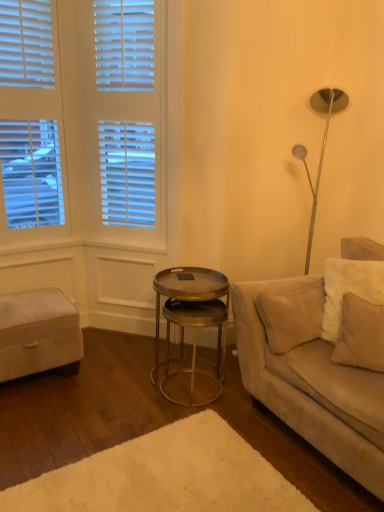
I want to click on free location above white plush rug at lower center (from a real-world perspective), so click(x=166, y=481).